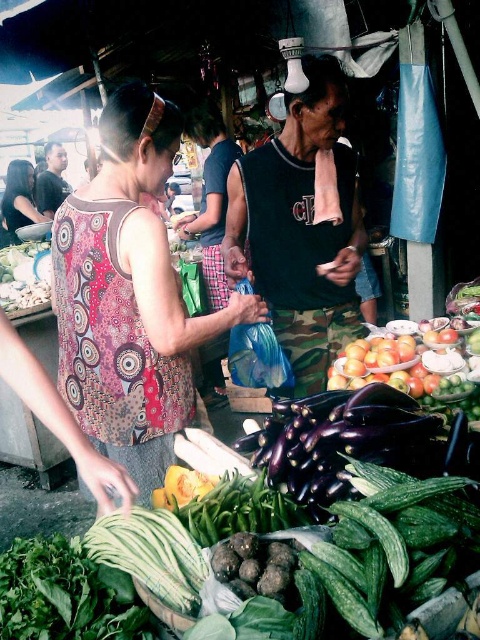
Does point (303, 321) come farther from viewer compared to point (49, 618)?

That is True.

You are a GUI agent. You are given a task and a screenshot of the screen. Output one action in this format:
    pyautogui.click(x=<x>, y=<y>)
    Task: Click on the camo fabric pants at center
    The image size is (480, 640).
    Given the screenshot: What is the action you would take?
    pyautogui.click(x=300, y=227)

Consider the image. Who is positioned more to the right, printed fabric tank top at center or camo fabric pants at center?

From the viewer's perspective, camo fabric pants at center appears more on the right side.

Does printed fabric tank top at center have a smaller size compared to camo fabric pants at center?

Yes, printed fabric tank top at center is smaller than camo fabric pants at center.

This screenshot has height=640, width=480. Identify the location of printed fabric tank top at center. (130, 296).

The image size is (480, 640). I want to click on printed fabric tank top at center, so click(130, 296).

Does printed fabric tank top at center have a larger size compared to green leafy at lower left?

Indeed, printed fabric tank top at center has a larger size compared to green leafy at lower left.

Is printed fabric tank top at center to the left of green leafy at lower left from the viewer's perspective?

Incorrect, printed fabric tank top at center is not on the left side of green leafy at lower left.

What do you see at coordinates (130, 296) in the screenshot? I see `printed fabric tank top at center` at bounding box center [130, 296].

At what (x,y) coordinates should I click in order to perform the action: click on printed fabric tank top at center. Please return your answer as a coordinate pair (x, y). Looking at the image, I should click on (130, 296).